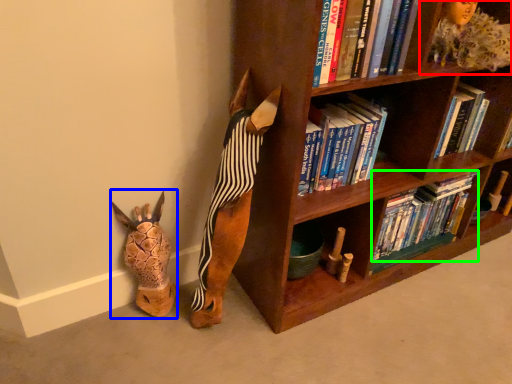
Question: Considering the real-world distances, which object is farthest from shelf (highlighted by a red box)? animal (highlighted by a blue box) or book (highlighted by a green box)?

Choices:
 (A) animal
 (B) book

Answer: (A)